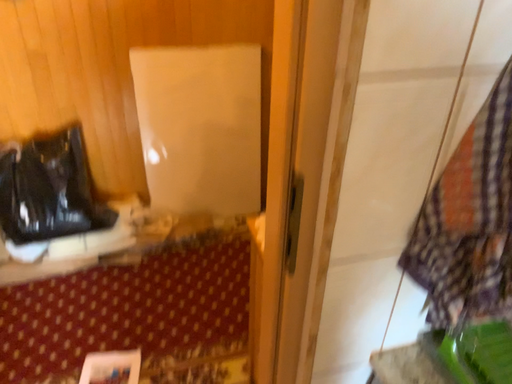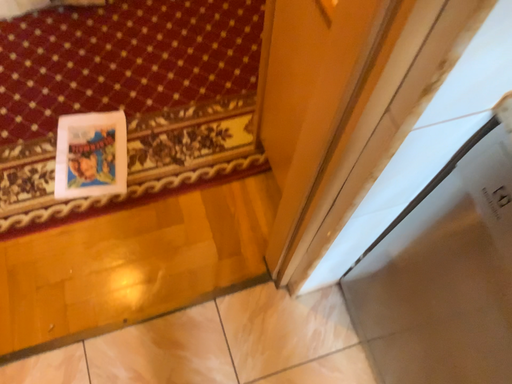
Question: Which way did the camera rotate in the video?

Choices:
 (A) rotated downward
 (B) rotated upward

Answer: (A)